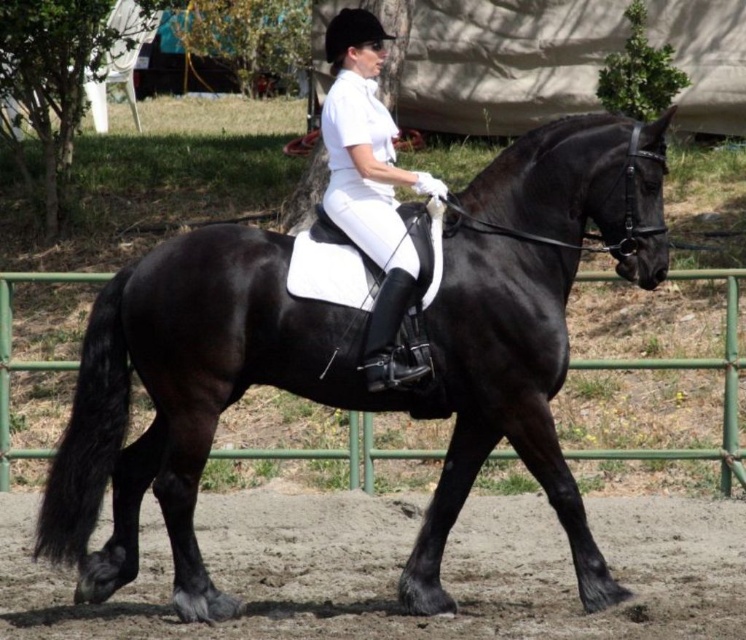
Based on the photo, you are an equestrian instructor observing a rider in the arena. You notice the white matte riding pants at center and the green metal fence at lower center. Which object is positioned to the right side from your viewpoint?

The white matte riding pants at center are to the right of the green metal fence at lower center.

You are a photographer positioned at the origin point of the coordinate system. You want to capture a photo of the shiny black horse at center. What are the coordinates of the horse?

The coordinates of the shiny black horse at center are at point (304, 396).

You are an equestrian instructor observing a rider in the arena. You notice the white matte riding pants at center and the green metal fence at lower center. Which object is taller from your viewpoint?

The white matte riding pants at center is much taller than the green metal fence at lower center.